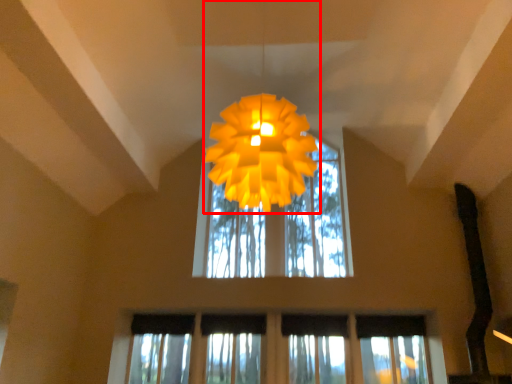
Question: From the image's perspective, where is lamp (annotated by the red box) located in relation to window in the image?

Choices:
 (A) above
 (B) below

Answer: (A)